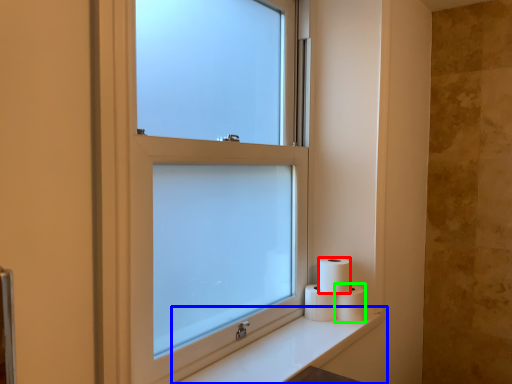
Question: Which is farther away from toilet paper (highlighted by a red box)? counter top (highlighted by a blue box) or toilet paper (highlighted by a green box)?

Choices:
 (A) counter top
 (B) toilet paper

Answer: (A)